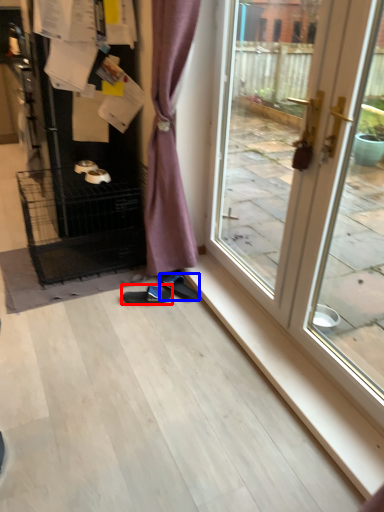
Question: Which point is closer to the camera, footwear (highlighted by a red box) or footwear (highlighted by a blue box)?

Choices:
 (A) footwear
 (B) footwear

Answer: (A)